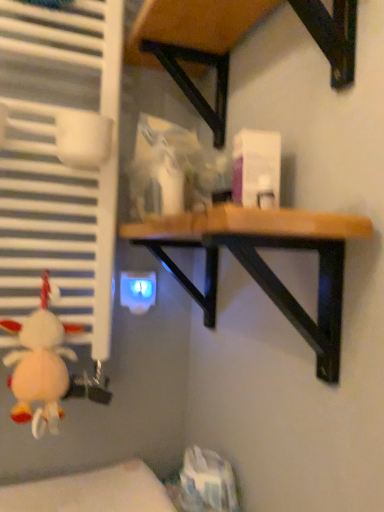
Question: Looking at the image, does wooden table at upper center, which is the 2th table in bottom-to-top order, seem bigger or smaller compared to wooden table at center, which is the first table in bottom-to-top order?

Choices:
 (A) big
 (B) small

Answer: (B)

Question: Choose the correct answer: Is wooden table at upper center, placed as the 1th table when sorted from top to bottom, inside wooden table at center, which is the second table in top-to-bottom order, or outside it?

Choices:
 (A) inside
 (B) outside

Answer: (B)

Question: Estimate the real-world distances between objects in this image. Which object is farther from the wooden table at upper center, which is the 2th table in bottom-to-top order?

Choices:
 (A) fluffy white plush at lower left
 (B) blue glossy electric outlet at lower center
 (C) wooden table at center, which is the first table in bottom-to-top order

Answer: (A)

Question: Which is farther from the fluffy white plush at lower left?

Choices:
 (A) wooden table at upper center, which is the 2th table in bottom-to-top order
 (B) wooden table at center, which is the second table in top-to-bottom order
 (C) blue glossy electric outlet at lower center

Answer: (A)